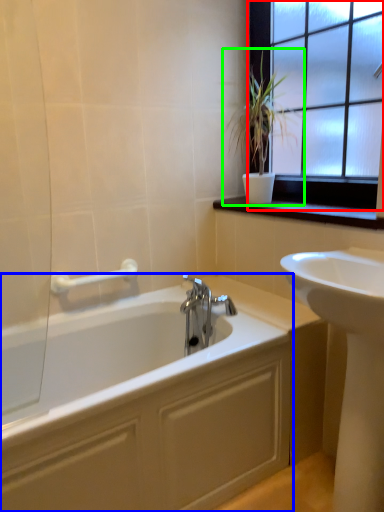
Question: Based on their relative distances, which object is farther from window (highlighted by a red box)? Choose from bathtub (highlighted by a blue box) and houseplant (highlighted by a green box).

Choices:
 (A) bathtub
 (B) houseplant

Answer: (A)